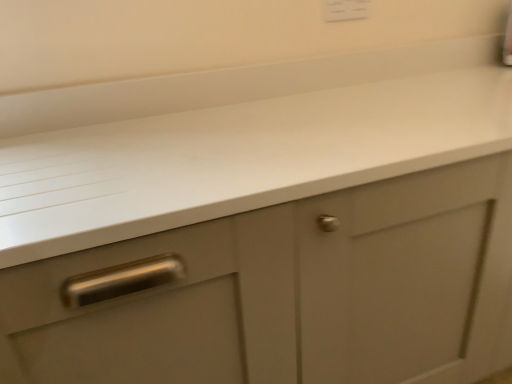
Question: Is white plastic electric outlet at upper center positioned with its back to white matte countertop at center?

Choices:
 (A) yes
 (B) no

Answer: (B)

Question: Can you confirm if white plastic electric outlet at upper center is thinner than white matte countertop at center?

Choices:
 (A) yes
 (B) no

Answer: (A)

Question: Is white plastic electric outlet at upper center surrounding white matte countertop at center?

Choices:
 (A) no
 (B) yes

Answer: (A)

Question: From the image's perspective, is white plastic electric outlet at upper center under white matte countertop at center?

Choices:
 (A) yes
 (B) no

Answer: (B)

Question: From the image's perspective, is white plastic electric outlet at upper center above white matte countertop at center?

Choices:
 (A) yes
 (B) no

Answer: (A)

Question: Are white plastic electric outlet at upper center and white matte countertop at center located far from each other?

Choices:
 (A) yes
 (B) no

Answer: (B)

Question: Are white matte countertop at center and white plastic electric outlet at upper center far apart?

Choices:
 (A) no
 (B) yes

Answer: (A)

Question: From the image's perspective, is white matte countertop at center under white plastic electric outlet at upper center?

Choices:
 (A) no
 (B) yes

Answer: (B)

Question: Is white matte countertop at center not within white plastic electric outlet at upper center?

Choices:
 (A) no
 (B) yes

Answer: (B)

Question: Are white matte countertop at center and white plastic electric outlet at upper center beside each other?

Choices:
 (A) yes
 (B) no

Answer: (B)

Question: Is white matte countertop at center shorter than white plastic electric outlet at upper center?

Choices:
 (A) yes
 (B) no

Answer: (B)

Question: From a real-world perspective, is white matte countertop at center located beneath white plastic electric outlet at upper center?

Choices:
 (A) no
 (B) yes

Answer: (B)

Question: From a real-world perspective, relative to white plastic electric outlet at upper center, is white matte countertop at center vertically above or below?

Choices:
 (A) above
 (B) below

Answer: (B)